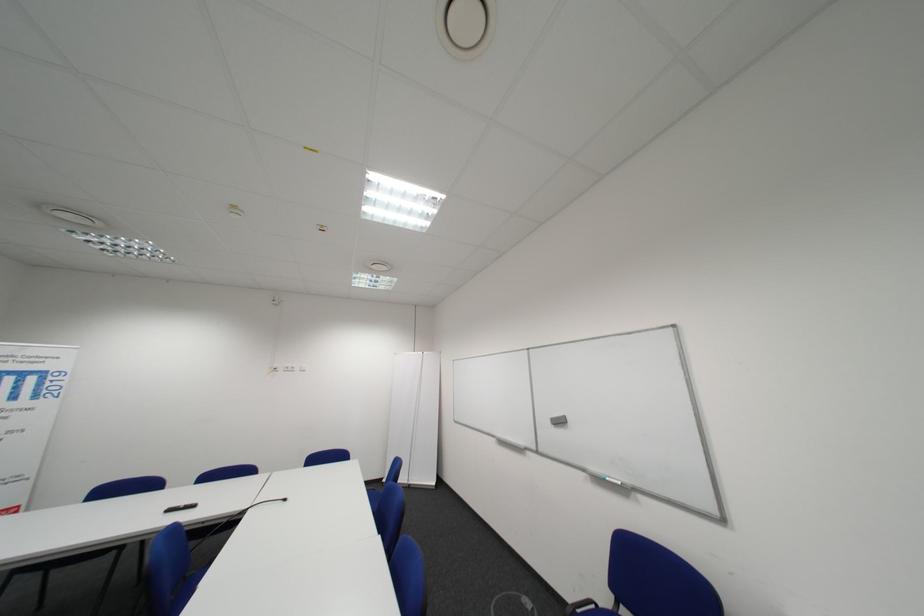
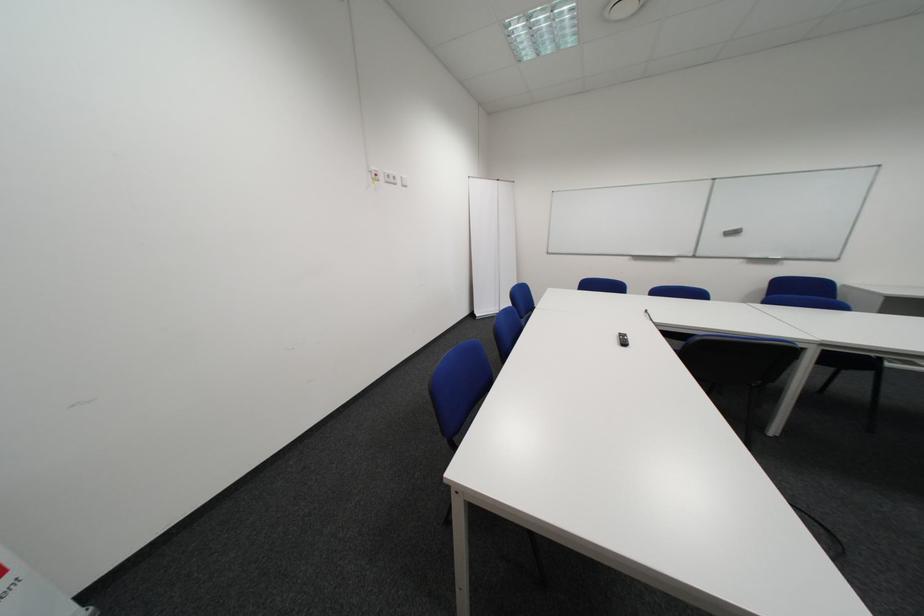
Find the pixel in the second image that matches the point at 298,371 in the first image.

(398, 180)